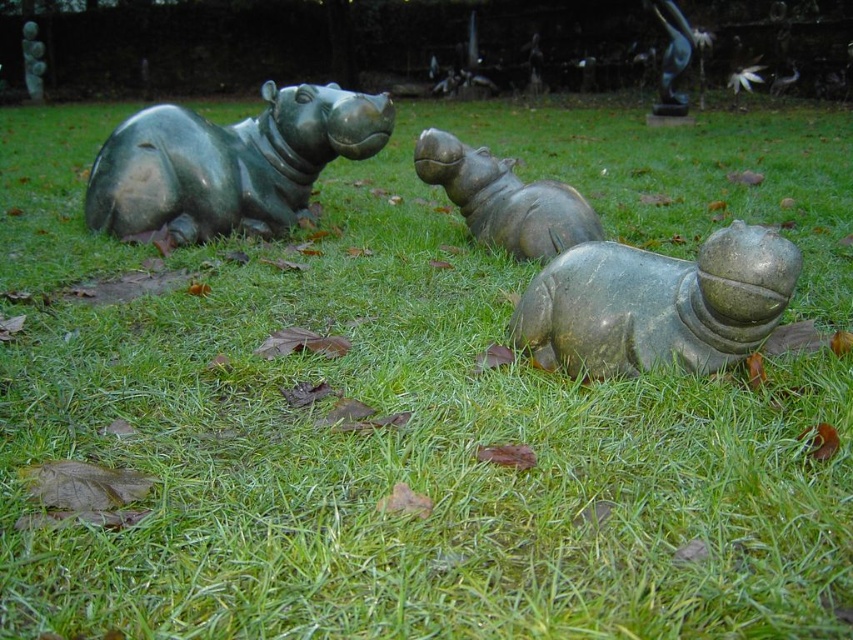
How much distance is there between green polished stone hippo at center and green polished stone hippo at upper left?

They are 43.73 feet apart.

Is green polished stone hippo at center taller than green polished stone hippo at upper left?

No.

Locate an element on the screen. Image resolution: width=853 pixels, height=640 pixels. green polished stone hippo at center is located at coordinates (656, 305).

Does bronze statue at upper right have a larger size compared to green polished stone hippo at upper left?

Yes, bronze statue at upper right is bigger than green polished stone hippo at upper left.

Who is positioned more to the right, bronze statue at upper right or green polished stone hippo at upper left?

From the viewer's perspective, bronze statue at upper right appears more on the right side.

The width and height of the screenshot is (853, 640). In order to click on bronze statue at upper right in this screenshot , I will do `click(672, 56)`.

What do you see at coordinates (503, 198) in the screenshot? This screenshot has height=640, width=853. I see `green polished hippo at center` at bounding box center [503, 198].

Does green polished hippo at center have a smaller size compared to green polished stone hippo at upper left?

Actually, green polished hippo at center might be larger than green polished stone hippo at upper left.

Is point (479, 189) positioned behind point (32, 67)?

No, it is not.

Identify the location of green polished hippo at center. (503, 198).